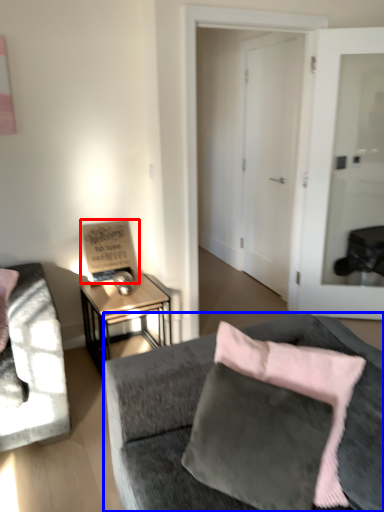
Question: Which object is further to the camera taking this photo, bulletin board (highlighted by a red box) or studio couch (highlighted by a blue box)?

Choices:
 (A) bulletin board
 (B) studio couch

Answer: (A)